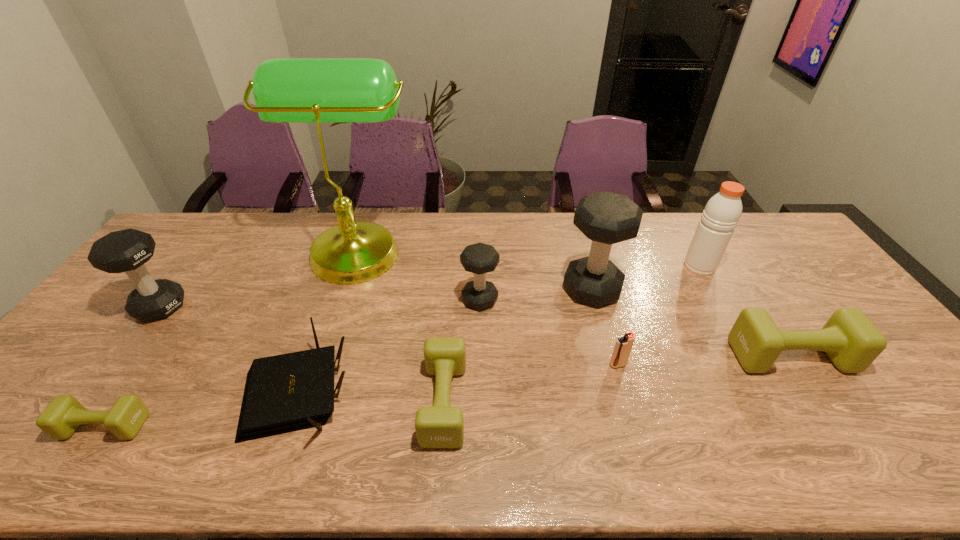
Identify the location of green lamp. (318, 90).

Locate an element on the screen. The height and width of the screenshot is (540, 960). lamp is located at coordinates (318, 90).

I want to click on the fifth dumbbell from left to right, so click(606, 218).

You are a GUI agent. You are given a task and a screenshot of the screen. Output one action in this format:
    pyautogui.click(x=<x>, y=<y>)
    Task: Click on the biggest gray dumbbell
    The height and width of the screenshot is (540, 960).
    Given the screenshot: What is the action you would take?
    pyautogui.click(x=606, y=218)

In order to click on orange shaker in this screenshot , I will do `click(721, 215)`.

The image size is (960, 540). Find the location of `the leftmost gray dumbbell`. the leftmost gray dumbbell is located at coordinates (128, 250).

This screenshot has height=540, width=960. Identify the location of the second biggest gray dumbbell. click(128, 250).

Find the location of `the second gray dumbbell from left to right`. the second gray dumbbell from left to right is located at coordinates (479, 258).

Where is `the fourth shortest dumbbell`? This screenshot has width=960, height=540. the fourth shortest dumbbell is located at coordinates (479, 258).

The width and height of the screenshot is (960, 540). In order to click on the biggest olive dumbbell in this screenshot , I will do `click(852, 342)`.